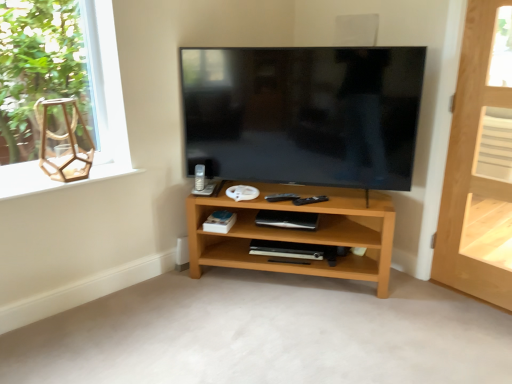
Question: Choose the correct answer: Is wooden hexagon at upper left inside matte black tv at center or outside it?

Choices:
 (A) outside
 (B) inside

Answer: (A)

Question: Does point (120, 165) appear closer or farther from the camera than point (330, 132)?

Choices:
 (A) farther
 (B) closer

Answer: (A)

Question: Which object is the farthest from the light brown wooden door at right?

Choices:
 (A) wooden hexagon at upper left
 (B) white matte shelf at right, the second shelf positioned from the bottom
 (C) white matte speaker at upper center
 (D) light brown wood shelf at center, marked as the first shelf in a left-to-right arrangement
 (E) wooden frame at left

Answer: (A)

Question: Considering the real-world distances, which object is closest to the light brown wooden door at right?

Choices:
 (A) white matte shelf at right, which is counted as the 1th shelf, starting from the back
 (B) white matte speaker at upper center
 (C) matte black tv at center
 (D) wooden frame at left
 (E) wooden hexagon at upper left

Answer: (A)